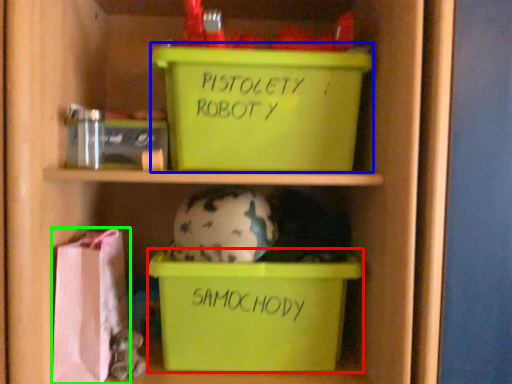
Question: Based on their relative distances, which object is farther from storage box (highlighted by a red box)? Choose from storage box (highlighted by a blue box) and material (highlighted by a green box).

Choices:
 (A) storage box
 (B) material

Answer: (A)